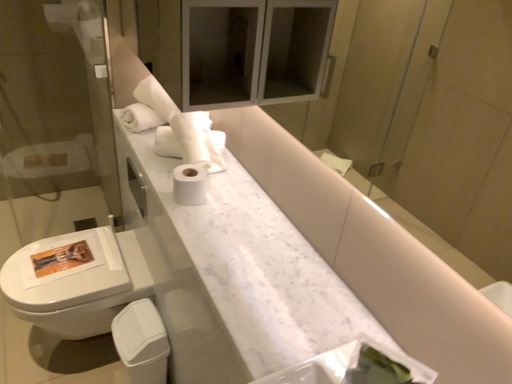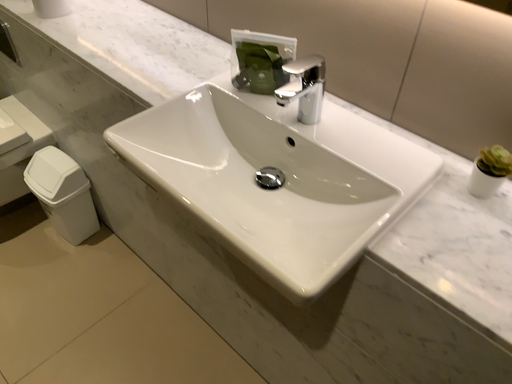
Question: Which way did the camera rotate in the video?

Choices:
 (A) rotated left
 (B) rotated right

Answer: (B)